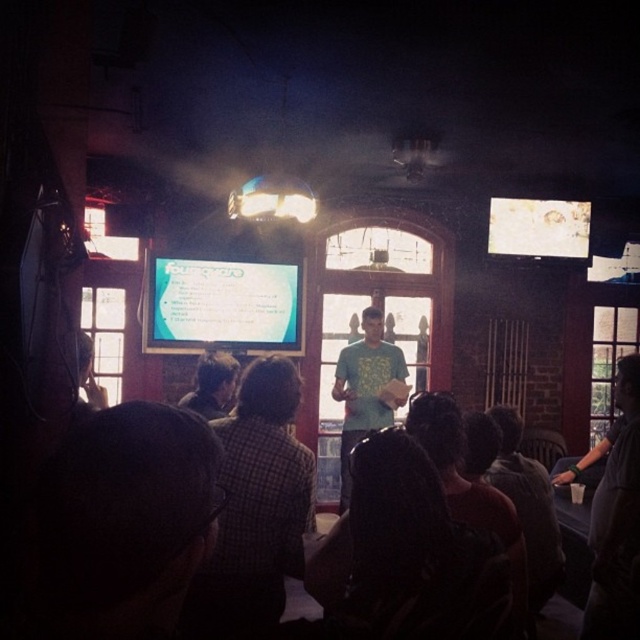
Question: Does green matte shirt at center have a larger size compared to plaid shirt at center?

Choices:
 (A) yes
 (B) no

Answer: (A)

Question: Is matte plastic projector screen at upper left wider than green matte shirt at center?

Choices:
 (A) no
 (B) yes

Answer: (B)

Question: Estimate the real-world distances between objects in this image. Which object is closer to the plaid shirt at center?

Choices:
 (A) matte plastic projector screen at upper left
 (B) green matte shirt at center

Answer: (A)

Question: Is checkered fabric shirt at lower left above green matte shirt at center?

Choices:
 (A) yes
 (B) no

Answer: (A)

Question: Which is farther from the matte plastic projector screen at upper left?

Choices:
 (A) plaid shirt at center
 (B) green matte shirt at center

Answer: (A)

Question: Which of the following is the closest to the observer?

Choices:
 (A) (401, 387)
 (B) (195, 394)

Answer: (B)